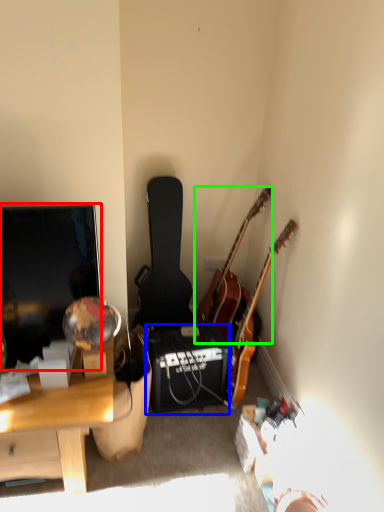
Question: Which object is positioned farthest from television (highlighted by a red box)? Select from loudspeaker (highlighted by a blue box) and guitar (highlighted by a green box).

Choices:
 (A) loudspeaker
 (B) guitar

Answer: (B)